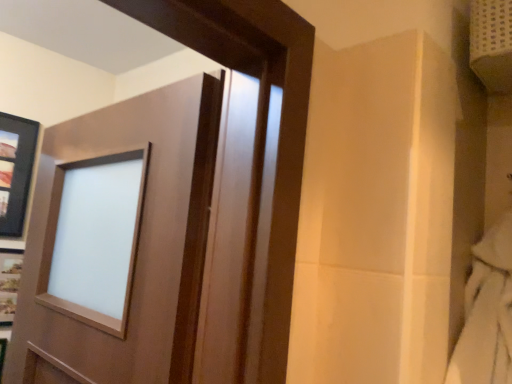
This screenshot has height=384, width=512. What do you see at coordinates (250, 175) in the screenshot?
I see `satin wood door at center` at bounding box center [250, 175].

Where is `satin wood door at center`? This screenshot has width=512, height=384. satin wood door at center is located at coordinates (250, 175).

Measure the distance between matte black picture frame at upper left and camera.

A: matte black picture frame at upper left and camera are 1.55 meters apart.

Where is `matte black picture frame at upper left`? Image resolution: width=512 pixels, height=384 pixels. matte black picture frame at upper left is located at coordinates coord(15,171).

What do you see at coordinates (15, 171) in the screenshot? This screenshot has width=512, height=384. I see `matte black picture frame at upper left` at bounding box center [15, 171].

What are the coordinates of `satin wood door at center` in the screenshot? It's located at point(250,175).

Which is more to the right, satin wood door at center or matte black picture frame at upper left?

Positioned to the right is satin wood door at center.

Is satin wood door at center further to the viewer compared to matte black picture frame at upper left?

That is False.

Considering the points (255, 193) and (3, 199), which point is in front, point (255, 193) or point (3, 199)?

The point (255, 193) is more forward.

From the image's perspective, relative to matte black picture frame at upper left, is satin wood door at center above or below?

Based on their image positions, satin wood door at center is located beneath matte black picture frame at upper left.

From a real-world perspective, who is located lower, satin wood door at center or matte black picture frame at upper left?

satin wood door at center.

Consider the image. Which object is thinner, satin wood door at center or matte black picture frame at upper left?

matte black picture frame at upper left is thinner.

Considering the relative sizes of satin wood door at center and matte black picture frame at upper left in the image provided, is satin wood door at center taller than matte black picture frame at upper left?

Yes.

From the picture: In terms of size, does satin wood door at center appear bigger or smaller than matte black picture frame at upper left?

Considering their sizes, satin wood door at center takes up more space than matte black picture frame at upper left.

Is satin wood door at center not within matte black picture frame at upper left?

Yes, satin wood door at center is located beyond the bounds of matte black picture frame at upper left.

Is satin wood door at center touching matte black picture frame at upper left?

There is a gap between satin wood door at center and matte black picture frame at upper left.

Looking at this image, is matte black picture frame at upper left at the back of satin wood door at center?

No, satin wood door at center's orientation is not away from matte black picture frame at upper left.

Measure the distance between satin wood door at center and matte black picture frame at upper left.

1.28 meters.

At what (x,y) coordinates should I click in order to perform the action: click on door located underneath the matte black picture frame at upper left (from a real-world perspective). Please return your answer as a coordinate pair (x, y). The height and width of the screenshot is (384, 512). Looking at the image, I should click on (250, 175).

Does matte black picture frame at upper left appear on the left side of satin wood door at center?

Yes, matte black picture frame at upper left is to the left of satin wood door at center.

Considering the positions of objects matte black picture frame at upper left and satin wood door at center in the image provided, who is behind, matte black picture frame at upper left or satin wood door at center?

matte black picture frame at upper left is more distant.

Which is nearer, (x=14, y=208) or (x=292, y=48)?

The point (x=292, y=48) is closer to the camera.

From the image's perspective, would you say matte black picture frame at upper left is positioned over satin wood door at center?

Indeed, from the image's perspective, matte black picture frame at upper left is shown above satin wood door at center.

From the picture: From a real-world perspective, is matte black picture frame at upper left physically above satin wood door at center?

Yes.

Considering the relative sizes of matte black picture frame at upper left and satin wood door at center in the image provided, is matte black picture frame at upper left wider than satin wood door at center?

In fact, matte black picture frame at upper left might be narrower than satin wood door at center.

In the scene shown: Does matte black picture frame at upper left have a lesser height compared to satin wood door at center?

Yes.

Does matte black picture frame at upper left have a smaller size compared to satin wood door at center?

Yes.

Looking at this image, is satin wood door at center a part of matte black picture frame at upper left?

No, satin wood door at center is located outside of matte black picture frame at upper left.

Is matte black picture frame at upper left next to satin wood door at center?

No, matte black picture frame at upper left is not with satin wood door at center.

Is matte black picture frame at upper left aimed at satin wood door at center?

Yes, matte black picture frame at upper left faces towards satin wood door at center.

How much distance is there between matte black picture frame at upper left and satin wood door at center?

4.20 feet.

Where is `door located below the matte black picture frame at upper left (from the image's perspective)`? The image size is (512, 384). door located below the matte black picture frame at upper left (from the image's perspective) is located at coordinates (250, 175).

Image resolution: width=512 pixels, height=384 pixels. I want to click on picture frame to the left of satin wood door at center, so click(15, 171).

Find the location of `door to the right of matte black picture frame at upper left`. door to the right of matte black picture frame at upper left is located at coordinates pyautogui.click(x=250, y=175).